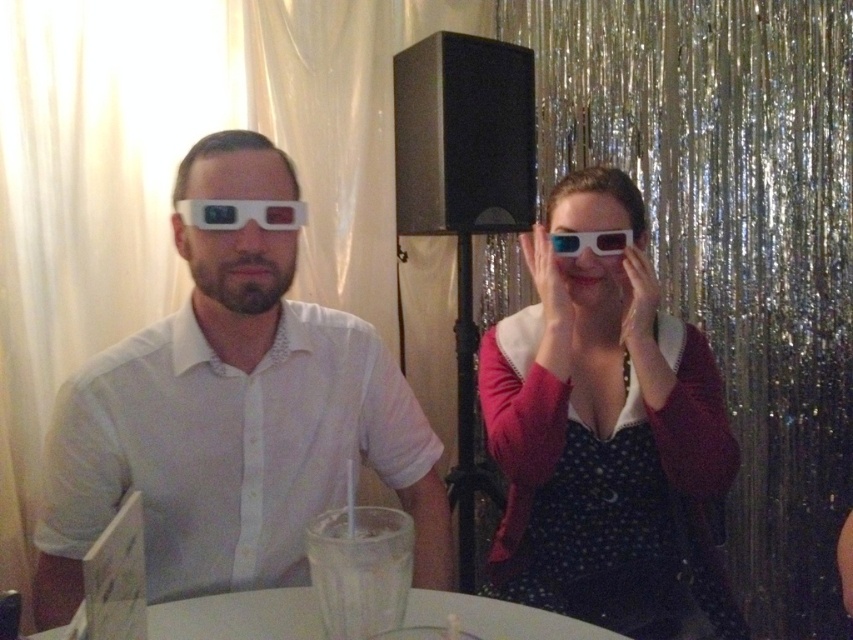
You are a photographer at a movie theater event. You need to capture a closeup of the white matte 3d glasses at left and the matte plastic goggles at center. Which object should you focus on first to ensure both are in frame?

The white matte 3d glasses at left should be focused on first since it is positioned under the matte plastic goggles at center, so adjusting the camera to include both would require starting with the lower one.

In the scene shown: You are a photographer adjusting the focus on your camera. You notice two points in the image at coordinates point (386, 435) and point (607, 630). Which point is closer to the camera?

Point (386, 435) is further to the camera than point (607, 630), so the closer point to the camera is point (607, 630).